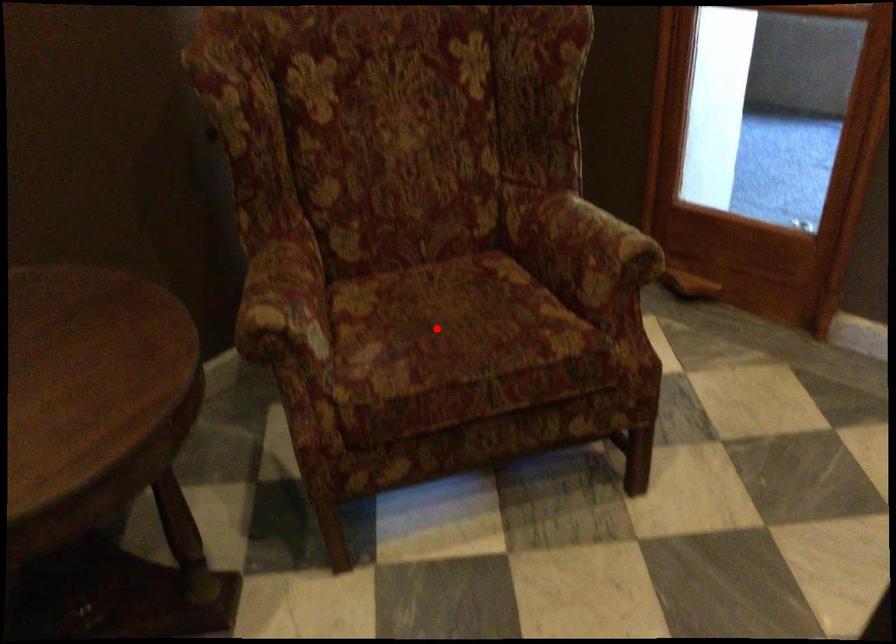
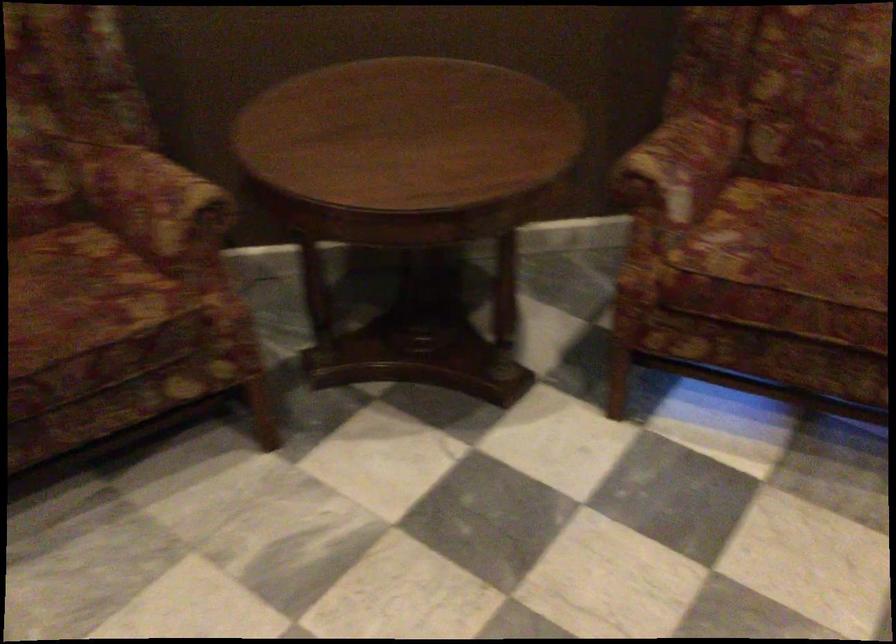
Question: I am providing you with two images of the same scene from different viewpoints. A red point is marked on the first image. Can you still see the location of the red point in image 2?

Choices:
 (A) Yes
 (B) No

Answer: (A)